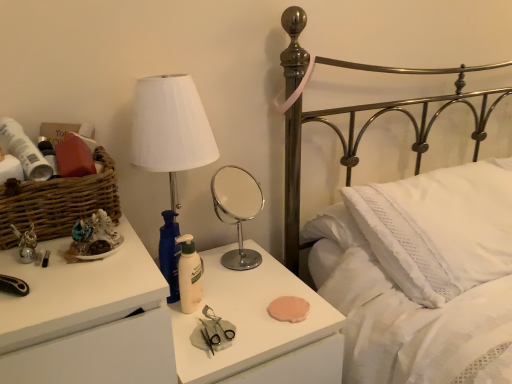
Find the location of a particular element. This screenshot has width=512, height=384. vacant area located to the right-hand side of white fabric lampshade at upper left is located at coordinates (259, 282).